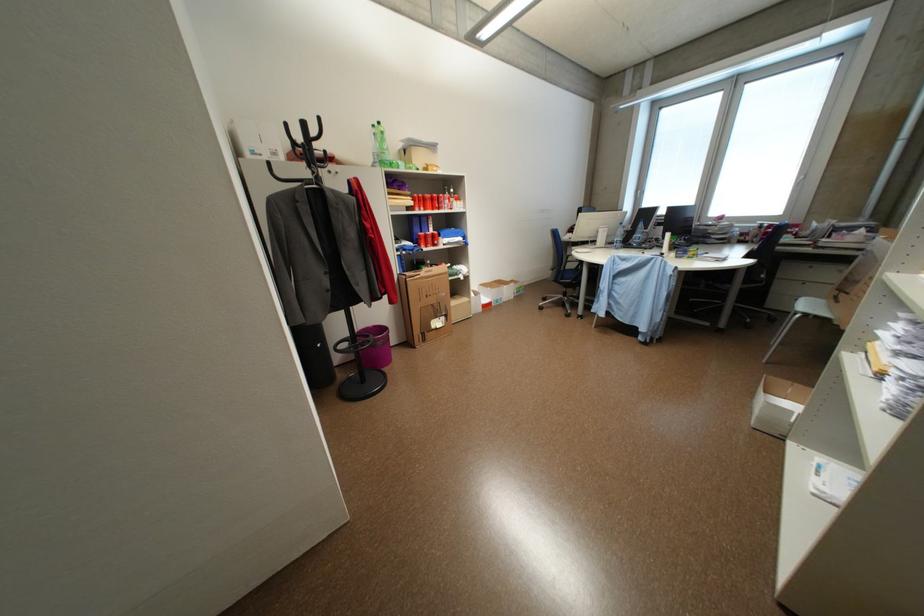
I want to click on cardboard box handle, so click(426, 304).